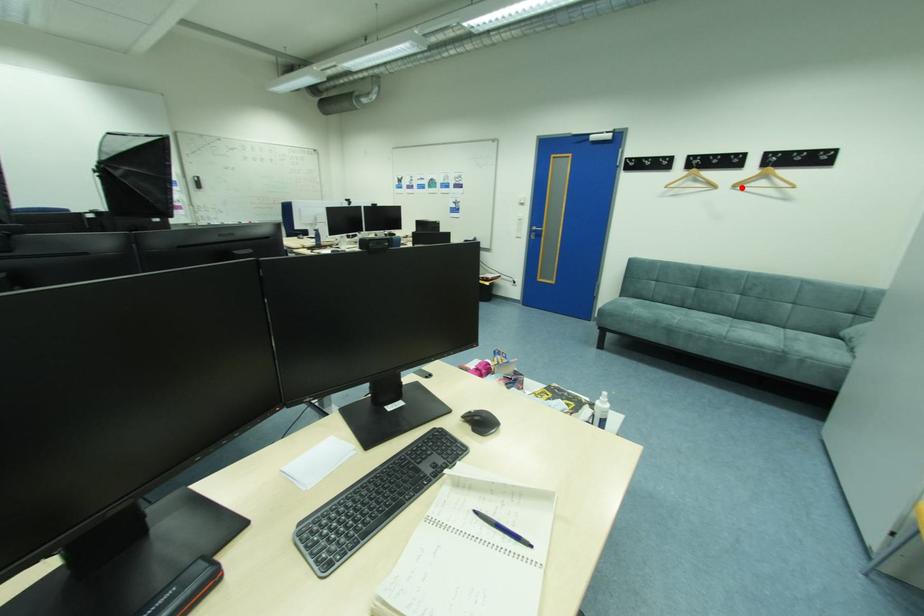
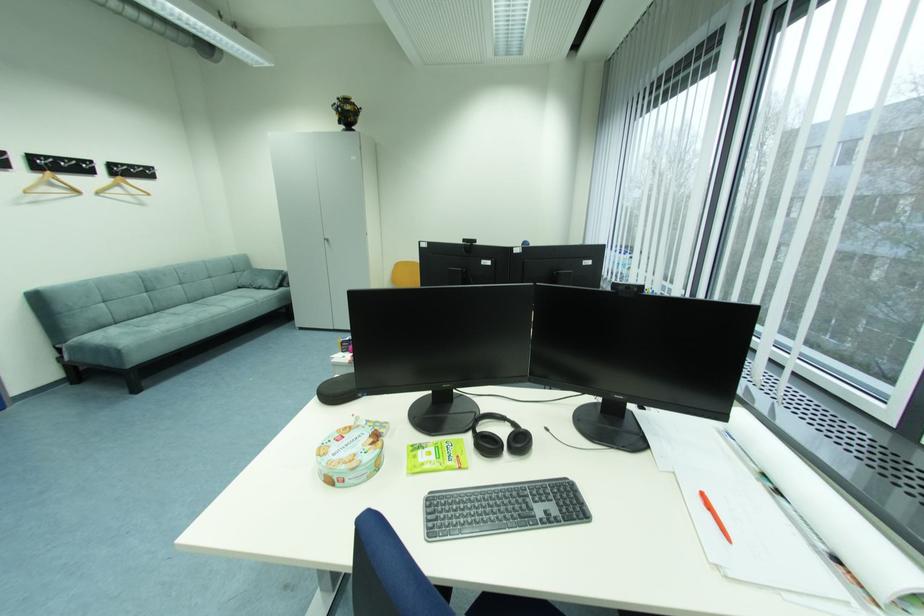
In the second image, find the point that corresponds to the highlighted location in the first image.

(104, 193)